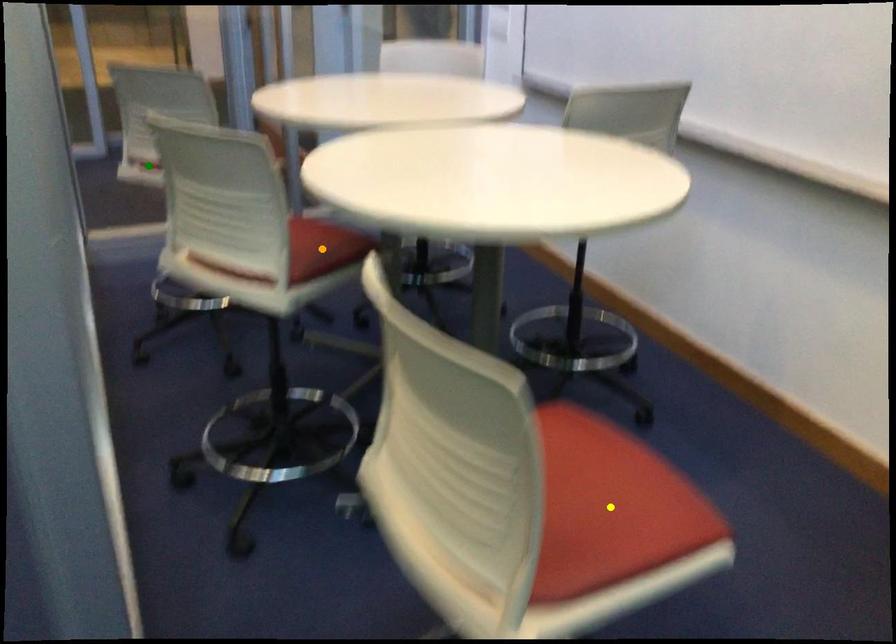
In the scene shown: Order these from farthest to nearest:
1. green point
2. orange point
3. yellow point

green point, orange point, yellow point